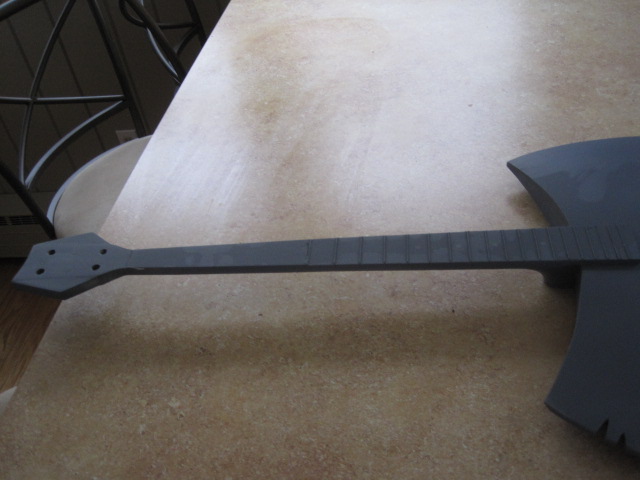
At what (x,y) coordinates should I click in order to perform the action: click on table surface. Please return your answer as a coordinate pair (x, y). Looking at the image, I should click on (406, 192).